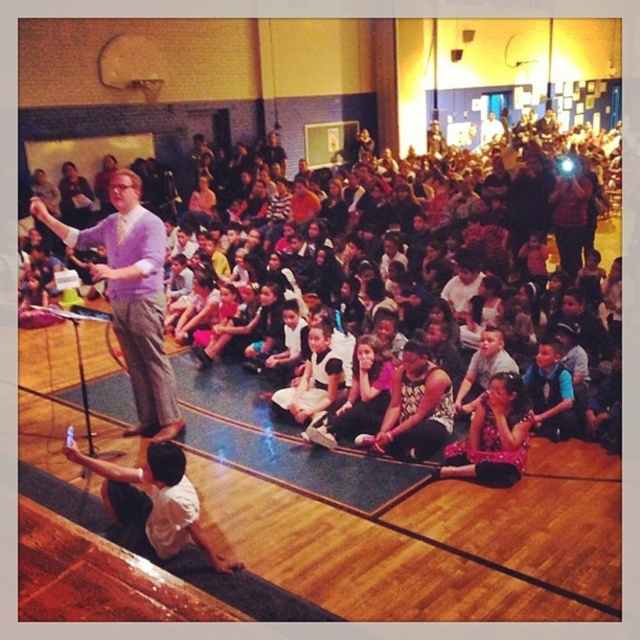
You are a student sitting at the back of the gymnasium. The stage is at the front. The purple shirt at center is the speaker. If you want to see the speaker better, should you move forward or backward?

Since the purple shirt at center is positioned at point [131,296], which is relatively close to the front of the stage, moving forward would bring you closer to the speaker, allowing for a better view.

You are standing at the point labeled point (310, 339) and want to walk towards the stage where the man is speaking. Is the point labeled point (492, 432) in your path?

Yes, the point labeled point (492, 432) is in your path because it is in front of point (310, 339) according to the spatial arrangement.